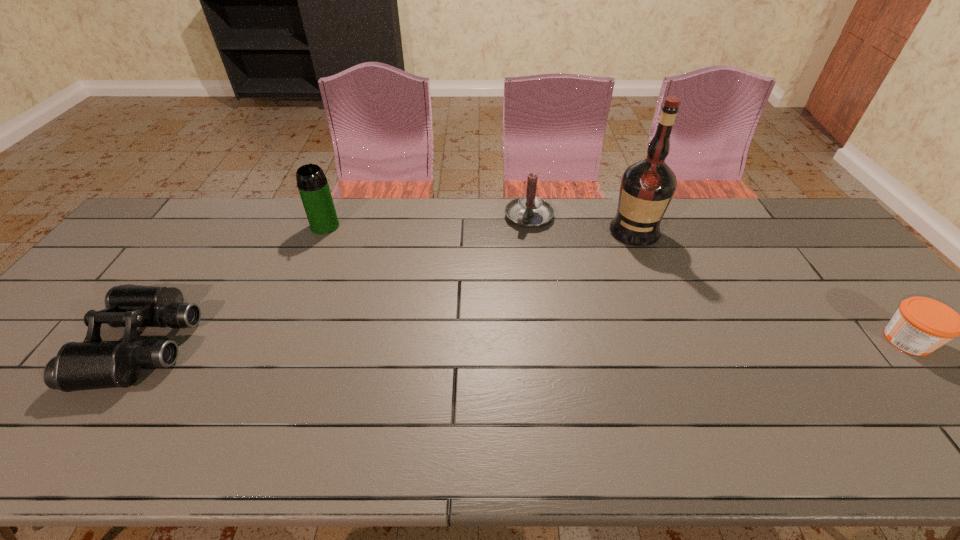
You are a GUI agent. You are given a task and a screenshot of the screen. Output one action in this format:
    pyautogui.click(x=<x>, y=<y>)
    Task: Click on the thermos bottle at the far edge
    This screenshot has height=540, width=960.
    Given the screenshot: What is the action you would take?
    pyautogui.click(x=312, y=183)

Where is `liquor present at the far edge`? The height and width of the screenshot is (540, 960). liquor present at the far edge is located at coordinates (647, 186).

The image size is (960, 540). In order to click on candle located in the far edge section of the desktop in this screenshot , I will do `click(528, 211)`.

The height and width of the screenshot is (540, 960). I want to click on object that is at the near edge, so click(92, 364).

The image size is (960, 540). I want to click on object present at the left edge, so click(x=92, y=364).

The height and width of the screenshot is (540, 960). In order to click on object that is positioned at the right edge in this screenshot , I will do `click(920, 325)`.

Where is `object that is at the near left corner`? Image resolution: width=960 pixels, height=540 pixels. object that is at the near left corner is located at coordinates (92, 364).

Where is `vacant area at the far edge`? Image resolution: width=960 pixels, height=540 pixels. vacant area at the far edge is located at coordinates (479, 234).

In the image, there is a desktop. Where is `free space at the near edge`? free space at the near edge is located at coordinates (666, 406).

This screenshot has height=540, width=960. In the image, there is a desktop. What are the coordinates of `free space at the left edge` in the screenshot? It's located at (125, 278).